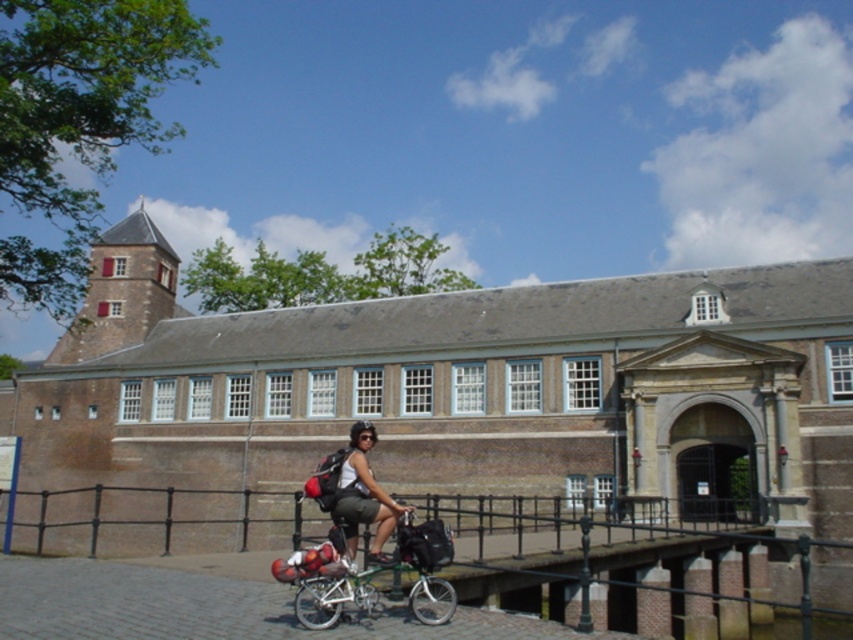
Question: Which object appears farthest from the camera in this image?

Choices:
 (A) green metallic bicycle at center
 (B) matte black backpack at center

Answer: (B)

Question: Can you confirm if black metal railing at center is thinner than green metallic bicycle at center?

Choices:
 (A) yes
 (B) no

Answer: (B)

Question: Among these points, which one is nearest to the camera?

Choices:
 (A) (32, 522)
 (B) (412, 532)

Answer: (B)

Question: Which point is closer to the camera?

Choices:
 (A) matte black backpack at center
 (B) green metallic bicycle at center

Answer: (B)

Question: Can you confirm if black metal railing at center is thinner than matte black backpack at center?

Choices:
 (A) yes
 (B) no

Answer: (B)

Question: Can you confirm if black metal railing at center is positioned above matte black backpack at center?

Choices:
 (A) no
 (B) yes

Answer: (A)